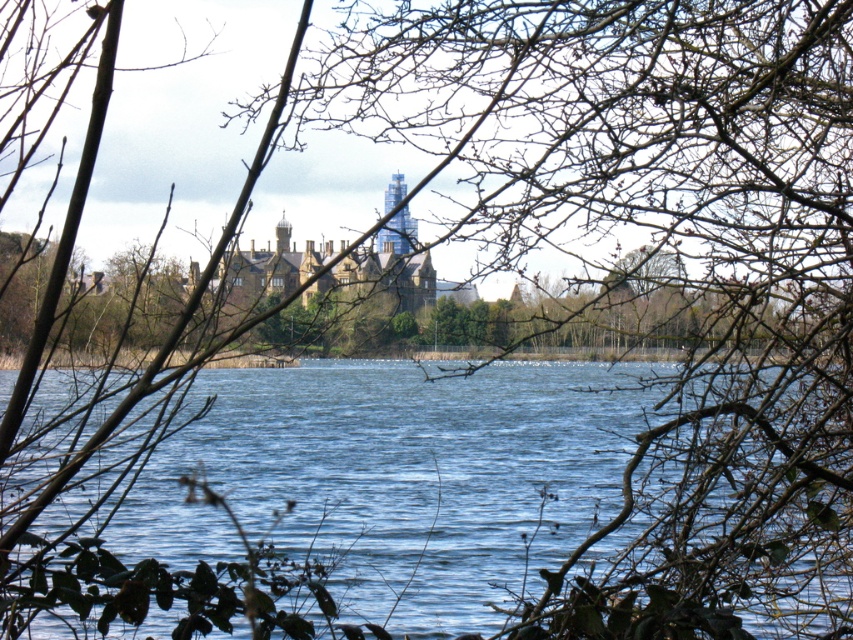
Does brown leafless branches at center have a lesser width compared to blue water at center?

Yes, brown leafless branches at center is thinner than blue water at center.

Can you confirm if brown leafless branches at center is positioned to the left of blue water at center?

In fact, brown leafless branches at center is to the right of blue water at center.

What do you see at coordinates (664, 266) in the screenshot? I see `brown leafless branches at center` at bounding box center [664, 266].

At what (x,y) coordinates should I click in order to perform the action: click on brown leafless branches at center. Please return your answer as a coordinate pair (x, y). Looking at the image, I should click on (664, 266).